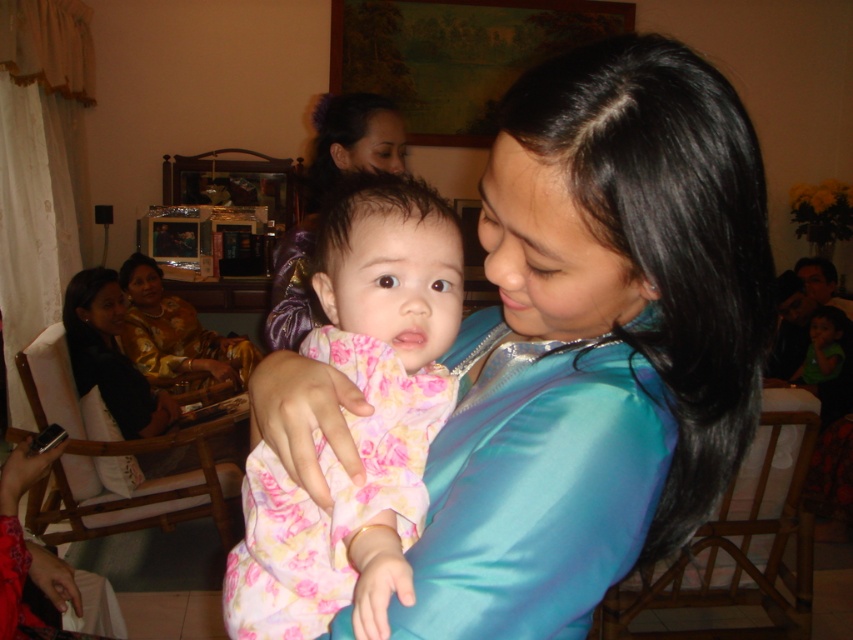
Can you confirm if pink floral dress at center is shorter than matte purple hair at center?

Indeed, pink floral dress at center has a lesser height compared to matte purple hair at center.

Identify the location of pink floral dress at center. (357, 419).

Which is in front, point (426, 260) or point (283, 348)?

Point (426, 260) is in front.

Identify the location of pink floral dress at center. The image size is (853, 640). (357, 419).

Is pink floral dress at center bigger than gold satin dress at left?

Incorrect, pink floral dress at center is not larger than gold satin dress at left.

Which is more to the right, pink floral dress at center or gold satin dress at left?

pink floral dress at center is more to the right.

Does point (370, 419) lie behind point (131, 280)?

No, (370, 419) is in front of (131, 280).

Locate an element on the screen. The image size is (853, 640). pink floral dress at center is located at coordinates (357, 419).

Does teal satin dress at center appear under matte purple hair at center?

Yes.

Can you confirm if teal satin dress at center is shorter than matte purple hair at center?

Yes.

Is point (608, 192) less distant than point (308, 316)?

Yes, it is in front of point (308, 316).

Find the location of a particular element. teal satin dress at center is located at coordinates (596, 342).